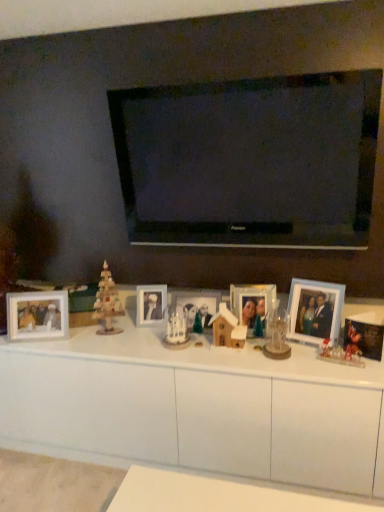
Identify the location of free space behind translucent plastic gingerbread house at lower right, acting as the 1th toy starting from the right. (319, 351).